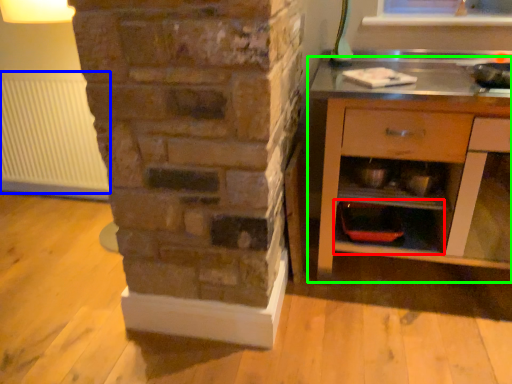
Question: Considering the real-world distances, which object is closest to shelf (highlighted by a red box)? radiator (highlighted by a blue box) or chest of drawers (highlighted by a green box).

Choices:
 (A) radiator
 (B) chest of drawers

Answer: (B)